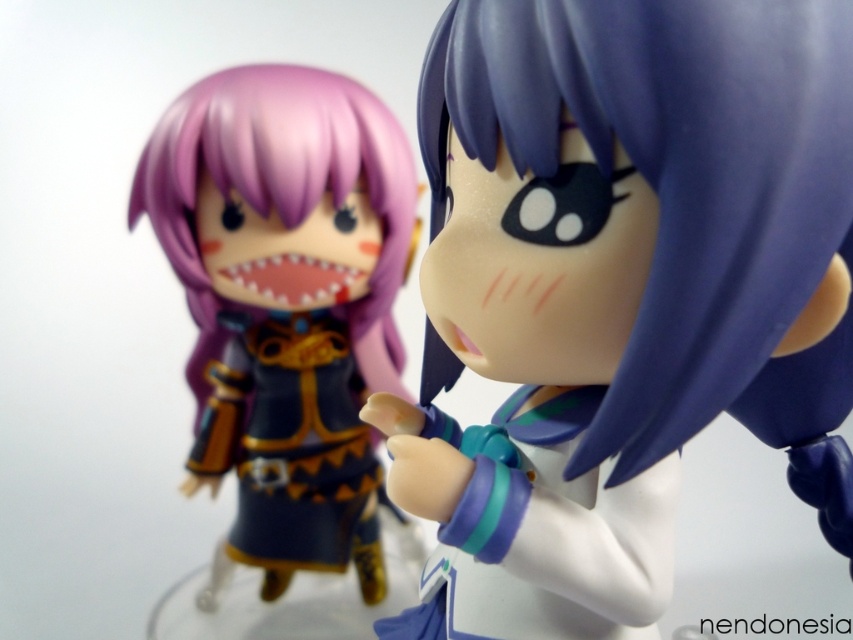
Is point (540, 333) behind point (357, 129)?

No, (540, 333) is in front of (357, 129).

Between point (544, 48) and point (318, 484), which one is positioned in front?

Point (544, 48) is more forward.

What do you see at coordinates (619, 292) in the screenshot? I see `satin purple hair at center` at bounding box center [619, 292].

Where is `satin purple hair at center`? satin purple hair at center is located at coordinates (619, 292).